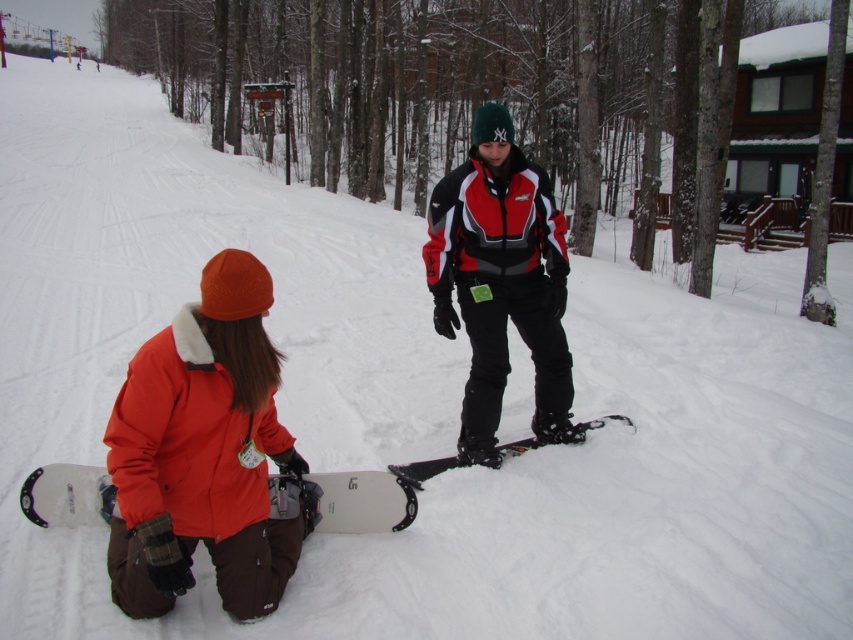
Question: Can you confirm if orange fleece jacket at lower left is smaller than white matte snowboard at lower left?

Choices:
 (A) yes
 (B) no

Answer: (B)

Question: Which is farther from the white matte snowboard at lower left?

Choices:
 (A) black matte snowboard at center
 (B) red-and-black snowsuit at center
 (C) orange fleece jacket at lower left

Answer: (B)

Question: Which of the following is the closest to the observer?

Choices:
 (A) (270, 305)
 (B) (82, 497)
 (C) (416, 474)

Answer: (A)

Question: Does orange fleece jacket at lower left have a smaller size compared to black matte snowboard at center?

Choices:
 (A) yes
 (B) no

Answer: (B)

Question: Does orange fleece jacket at lower left come in front of red-and-black snowsuit at center?

Choices:
 (A) yes
 (B) no

Answer: (A)

Question: Which point is closer to the camera taking this photo?

Choices:
 (A) (257, 563)
 (B) (390, 502)

Answer: (A)